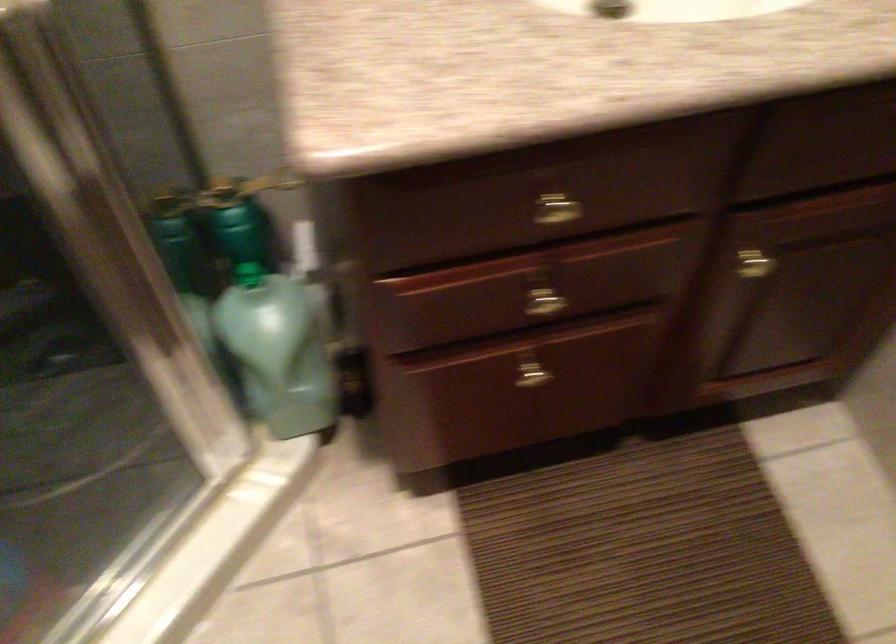
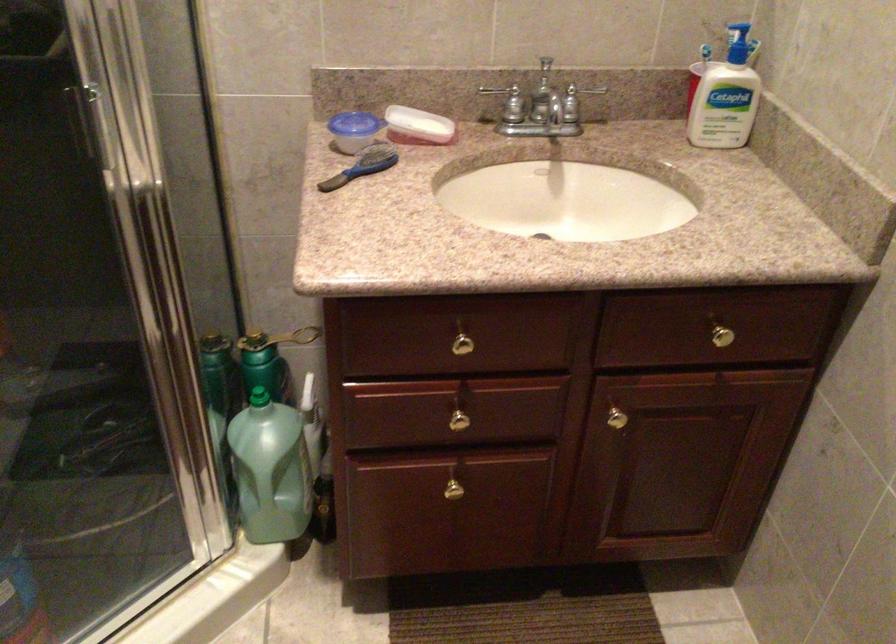
Find the pixel in the second image that matches point 539,295 in the first image.

(459, 415)